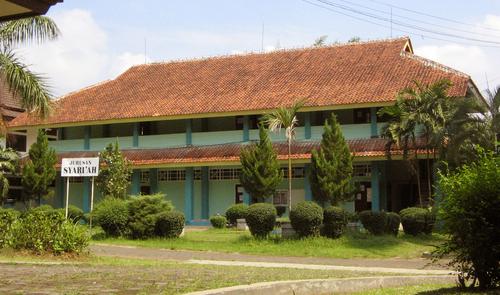
Where is `electrical wire`? This screenshot has height=295, width=500. electrical wire is located at coordinates (369, 11), (400, 11).